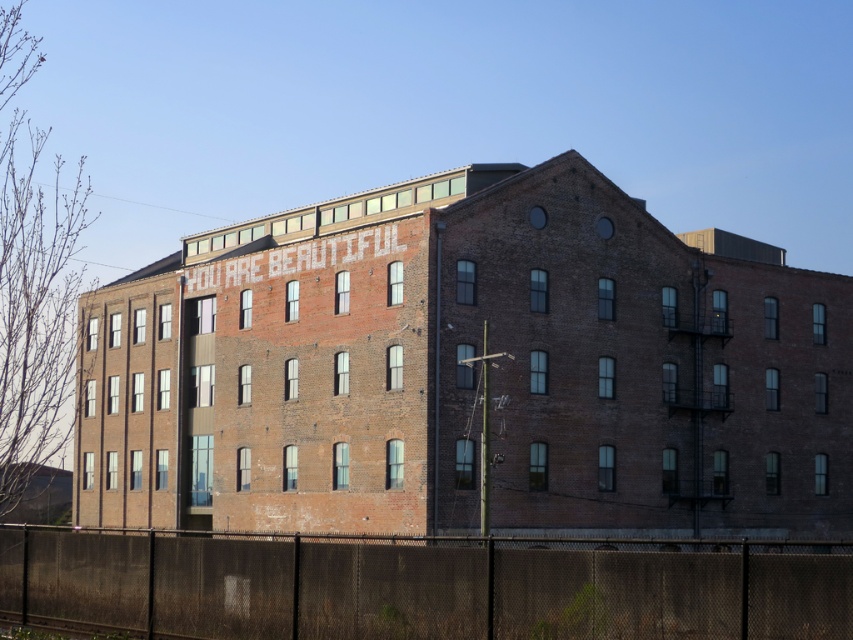
Question: Is brown brick building at center below black mesh fence at lower center?

Choices:
 (A) yes
 (B) no

Answer: (B)

Question: Which of the following is the farthest from the observer?

Choices:
 (A) (834, 566)
 (B) (509, 476)

Answer: (B)

Question: Can you confirm if brown brick building at center is smaller than black mesh fence at lower center?

Choices:
 (A) no
 (B) yes

Answer: (A)

Question: Which point appears closest to the camera in this image?

Choices:
 (A) (492, 300)
 (B) (16, 586)

Answer: (B)

Question: Can you confirm if brown brick building at center is thinner than black mesh fence at lower center?

Choices:
 (A) no
 (B) yes

Answer: (A)